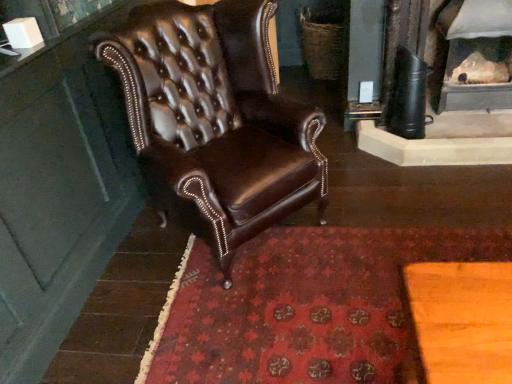
Image resolution: width=512 pixels, height=384 pixels. Find the location of `vacant space in front of brown leather chair at center`. vacant space in front of brown leather chair at center is located at coordinates (238, 326).